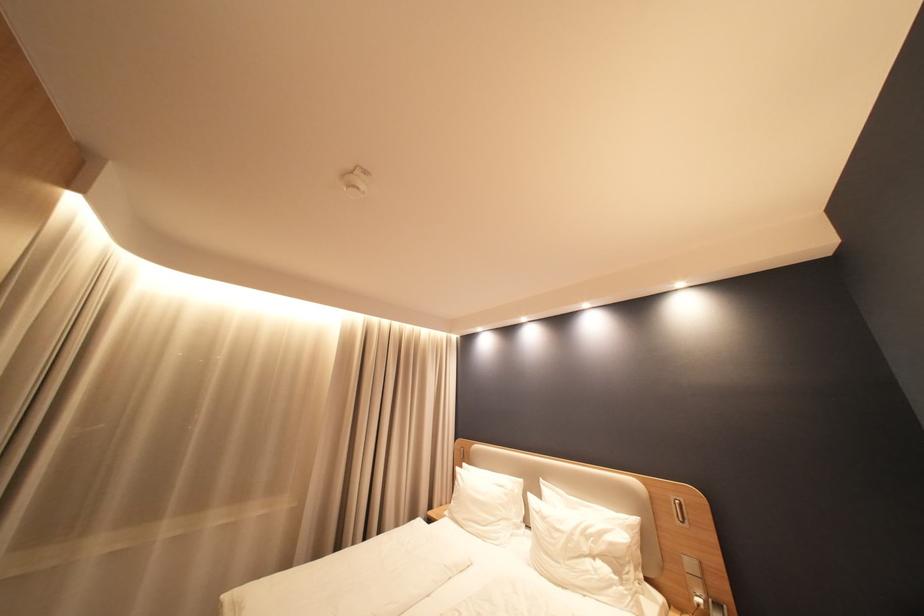
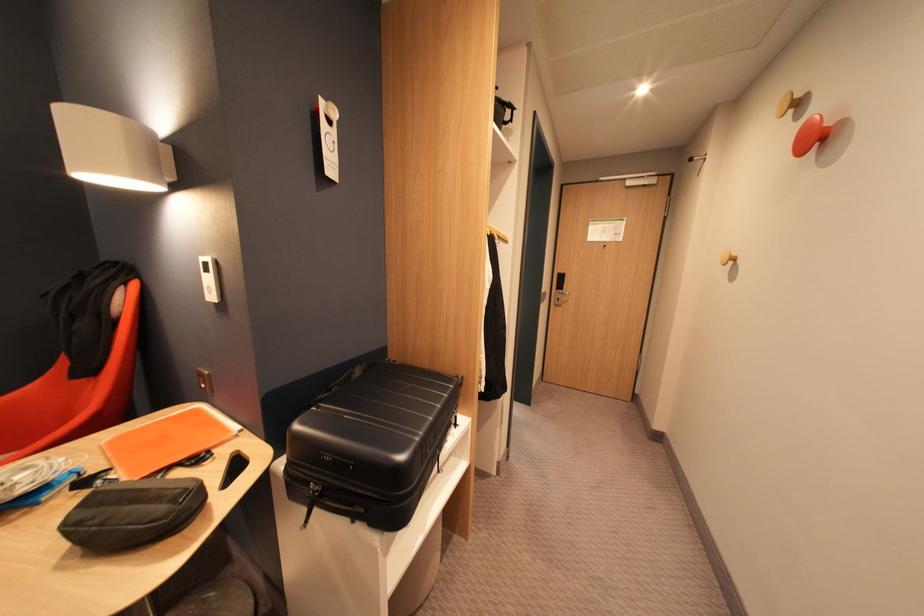
Question: The first image is from the beginning of the video and the second image is from the end. How did the camera likely rotate when shooting the video?

Choices:
 (A) Left
 (B) Right
 (C) Up
 (D) Down

Answer: (B)